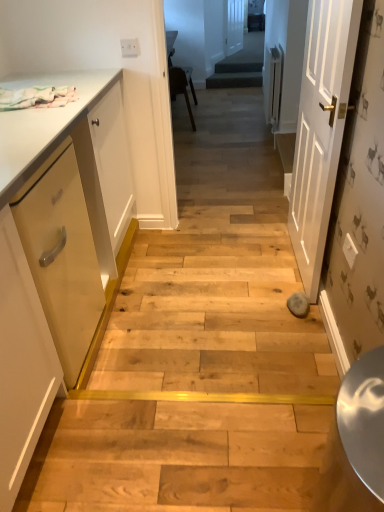
This screenshot has width=384, height=512. What are the coordinates of `white wooden door at center, which appears as the second door when viewed from the front` in the screenshot? It's located at (235, 25).

Image resolution: width=384 pixels, height=512 pixels. What do you see at coordinates (320, 129) in the screenshot?
I see `white painted wood door at center right, placed as the second door when sorted from back to front` at bounding box center [320, 129].

The width and height of the screenshot is (384, 512). What do you see at coordinates (234, 80) in the screenshot?
I see `dark green carpeted stairs at center` at bounding box center [234, 80].

In order to click on white wooden door at center, the second door ordered from the bottom in this screenshot , I will do `click(235, 25)`.

Is there a large distance between matte yellow drawer at left and matte white cabinet at left?

No, there isn't a large distance between matte yellow drawer at left and matte white cabinet at left.

Measure the distance from matte yellow drawer at left to matte white cabinet at left.

matte yellow drawer at left and matte white cabinet at left are 9.28 centimeters apart from each other.

Is matte yellow drawer at left surrounding matte white cabinet at left?

Actually, matte white cabinet at left is outside matte yellow drawer at left.

Can you confirm if matte yellow drawer at left is wider than matte white cabinet at left?

Incorrect, the width of matte yellow drawer at left does not surpass that of matte white cabinet at left.

Who is smaller, matte white cabinet at left or matte yellow drawer at left?

matte yellow drawer at left is smaller.

From the image's perspective, is matte white cabinet at left above matte yellow drawer at left?

Correct, matte white cabinet at left appears higher than matte yellow drawer at left in the image.

From a real-world perspective, is matte white cabinet at left over matte yellow drawer at left?

No, from a real-world perspective, matte white cabinet at left is not above matte yellow drawer at left.

From the image's perspective, is white painted wood door at center right, the 1th door viewed from the front, beneath dark green carpeted stairs at center?

Yes, from the image's perspective, white painted wood door at center right, the 1th door viewed from the front, is below dark green carpeted stairs at center.

Does white painted wood door at center right, the 1th door viewed from the front, have a lesser width compared to dark green carpeted stairs at center?

Incorrect, the width of white painted wood door at center right, the 1th door viewed from the front, is not less than that of dark green carpeted stairs at center.

Considering the relative positions of white painted wood door at center right, which is counted as the 1th door, starting from the bottom, and dark green carpeted stairs at center in the image provided, is white painted wood door at center right, which is counted as the 1th door, starting from the bottom, in front of dark green carpeted stairs at center?

Yes.

Is point (318, 230) positioned behind point (209, 82)?

No.

How many degrees apart are the facing directions of white wooden door at center, which appears as the second door when viewed from the front, and white painted wood door at center right, which is counted as the 1th door, starting from the bottom?

There is a 158-degree angle between the facing directions of white wooden door at center, which appears as the second door when viewed from the front, and white painted wood door at center right, which is counted as the 1th door, starting from the bottom.

From the image's perspective, between white wooden door at center, the first door when ordered from back to front, and white painted wood door at center right, the 1th door viewed from the front, which one is located above?

white wooden door at center, the first door when ordered from back to front.

Considering the relative sizes of white wooden door at center, the first door when ordered from back to front, and white painted wood door at center right, the 1th door viewed from the front, in the image provided, is white wooden door at center, the first door when ordered from back to front, wider than white painted wood door at center right, the 1th door viewed from the front,?

Correct, the width of white wooden door at center, the first door when ordered from back to front, exceeds that of white painted wood door at center right, the 1th door viewed from the front.

Who is taller, white painted wood door at center right, which is counted as the 1th door, starting from the bottom, or matte yellow drawer at left?

white painted wood door at center right, which is counted as the 1th door, starting from the bottom.

What's the angular difference between white painted wood door at center right, the 1th door viewed from the front, and matte yellow drawer at left's facing directions?

There is a 178-degree angle between the facing directions of white painted wood door at center right, the 1th door viewed from the front, and matte yellow drawer at left.

From the image's perspective, is white painted wood door at center right, which is counted as the 1th door, starting from the bottom, above or below matte yellow drawer at left?

white painted wood door at center right, which is counted as the 1th door, starting from the bottom, is situated higher than matte yellow drawer at left in the image.

Are white painted wood door at center right, the 1th door viewed from the front, and matte yellow drawer at left far apart?

That's right, there is a large distance between white painted wood door at center right, the 1th door viewed from the front, and matte yellow drawer at left.

How many degrees apart are the facing directions of matte white cabinet at left and white wooden door at center, which appears as the second door when viewed from the front?

There is a 21.1-degree angle between the facing directions of matte white cabinet at left and white wooden door at center, which appears as the second door when viewed from the front.

Which of these two, matte white cabinet at left or white wooden door at center, arranged as the first door when viewed from the top, is thinner?

With smaller width is white wooden door at center, arranged as the first door when viewed from the top.

Between matte white cabinet at left and white wooden door at center, arranged as the first door when viewed from the top, which one is positioned in front?

matte white cabinet at left.

Is matte white cabinet at left situated inside white wooden door at center, the second door ordered from the bottom, or outside?

matte white cabinet at left is outside white wooden door at center, the second door ordered from the bottom.

Which object is closer to the camera taking this photo, white painted wood door at center right, which is counted as the 1th door, starting from the bottom, or white wooden door at center, which appears as the second door when viewed from the front?

white painted wood door at center right, which is counted as the 1th door, starting from the bottom, is more forward.

Between point (298, 213) and point (242, 45), which one is positioned in front?

The point (298, 213) is more forward.

Based on the photo, is white wooden door at center, the second door ordered from the bottom, inside white painted wood door at center right, acting as the second door starting from the top?

That's incorrect, white wooden door at center, the second door ordered from the bottom, is not inside white painted wood door at center right, acting as the second door starting from the top.

Where is `drawer that is below the matte white cabinet at left (from the image's perspective)`? This screenshot has height=512, width=384. drawer that is below the matte white cabinet at left (from the image's perspective) is located at coordinates (62, 255).

Where is `drawer positioned vertically above the matte white cabinet at left (from a real-world perspective)`? This screenshot has width=384, height=512. drawer positioned vertically above the matte white cabinet at left (from a real-world perspective) is located at coordinates (62, 255).

Looking at the image, which one is located further to matte yellow drawer at left, dark green carpeted stairs at center or white painted wood door at center right, placed as the second door when sorted from back to front?

dark green carpeted stairs at center is positioned further to the anchor matte yellow drawer at left.

Looking at the image, which one is located closer to matte yellow drawer at left, dark green carpeted stairs at center or matte white cabinet at left?

Based on the image, matte white cabinet at left appears to be nearer to matte yellow drawer at left.

Estimate the real-world distances between objects in this image. Which object is further from matte white cabinet at left, dark green carpeted stairs at center or matte yellow drawer at left?

dark green carpeted stairs at center is positioned further to the anchor matte white cabinet at left.

Based on their spatial positions, is matte yellow drawer at left or matte white cabinet at left closer to white painted wood door at center right, acting as the second door starting from the top?

Among the two, matte white cabinet at left is located nearer to white painted wood door at center right, acting as the second door starting from the top.

Estimate the real-world distances between objects in this image. Which object is closer to white wooden door at center, arranged as the first door when viewed from the top, matte white cabinet at left or white painted wood door at center right, acting as the second door starting from the top?

The object closer to white wooden door at center, arranged as the first door when viewed from the top, is white painted wood door at center right, acting as the second door starting from the top.

Considering their positions, is white wooden door at center, the first door when ordered from back to front, positioned closer to matte white cabinet at left than dark green carpeted stairs at center?

dark green carpeted stairs at center is positioned closer to the anchor matte white cabinet at left.

From the image, which object appears to be farther from matte yellow drawer at left, white wooden door at center, arranged as the first door when viewed from the top, or matte white cabinet at left?

The object further to matte yellow drawer at left is white wooden door at center, arranged as the first door when viewed from the top.

Based on their spatial positions, is matte white cabinet at left or matte yellow drawer at left further from white wooden door at center, the first door when ordered from back to front?

Among the two, matte yellow drawer at left is located further to white wooden door at center, the first door when ordered from back to front.

Locate an element on the screen. stairs positioned between white painted wood door at center right, placed as the second door when sorted from back to front, and white wooden door at center, which appears as the second door when viewed from the front, from near to far is located at coordinates (234, 80).

The width and height of the screenshot is (384, 512). What are the coordinates of `door between matte white cabinet at left and dark green carpeted stairs at center along the z-axis` in the screenshot? It's located at (320, 129).

This screenshot has width=384, height=512. In order to click on door located between matte yellow drawer at left and white wooden door at center, the second door ordered from the bottom, in the depth direction in this screenshot , I will do `click(320, 129)`.

The image size is (384, 512). I want to click on door between matte white cabinet at left and white wooden door at center, the second door ordered from the bottom, in the front-back direction, so click(x=320, y=129).